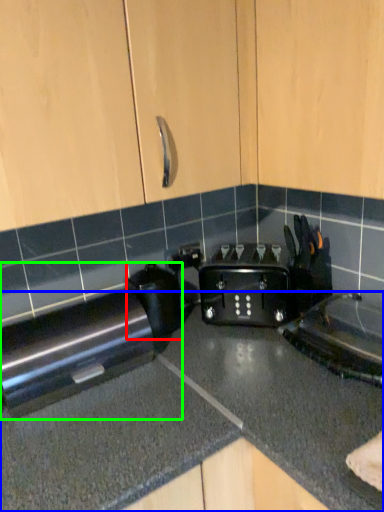
Question: Which object is the farthest from appliance (highlighted by a red box)? Choose among these: countertop (highlighted by a blue box) or home appliance (highlighted by a green box).

Choices:
 (A) countertop
 (B) home appliance

Answer: (A)